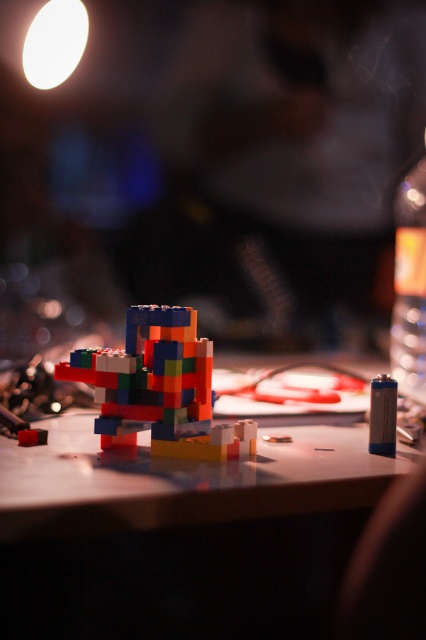
Who is positioned more to the right, matte plastic table at center or multicolored plastic toy at center?

matte plastic table at center is more to the right.

Who is more distant from viewer, (89, 417) or (181, 451)?

The point (89, 417) is behind.

Locate an element on the screen. Image resolution: width=426 pixels, height=640 pixels. matte plastic table at center is located at coordinates (183, 534).

Which is behind, point (175, 388) or point (405, 356)?

Positioned behind is point (405, 356).

Consider the image. Is multicolored plastic toy at center closer to camera compared to transparent plastic bottle at right?

Yes, it is in front of transparent plastic bottle at right.

Who is more distant from viewer, (158,328) or (425,384)?

Positioned behind is point (425,384).

At what (x,y) coordinates should I click in order to perform the action: click on multicolored plastic toy at center. Please return your answer as a coordinate pair (x, y). Image resolution: width=426 pixels, height=640 pixels. Looking at the image, I should click on (158, 388).

Between point (357, 429) and point (409, 244), which one is positioned behind?

Positioned behind is point (409, 244).

Is the position of matte plastic table at center less distant than that of transparent plastic bottle at right?

Yes.

Does point (310, 454) come farther from viewer compared to point (399, 268)?

No.

At what (x,y) coordinates should I click in order to perform the action: click on matte plastic table at center. Please return your answer as a coordinate pair (x, y). The height and width of the screenshot is (640, 426). Looking at the image, I should click on (183, 534).